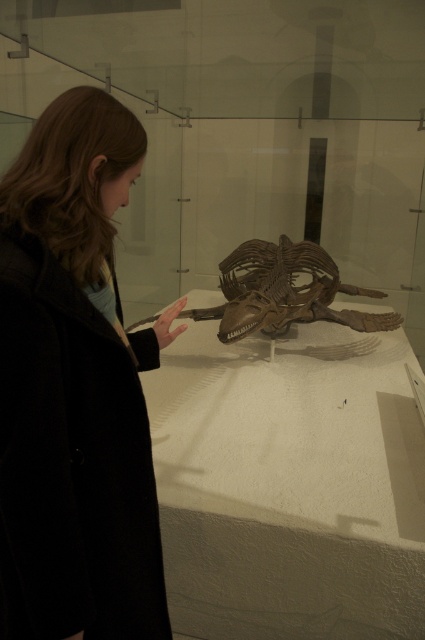
How distant is black wool coat at left from brown wooden skeleton at center?

They are 5.82 feet apart.

Who is more distant from viewer, (85, 326) or (345, 314)?

Positioned behind is point (345, 314).

Identify the location of black wool coat at left. (76, 387).